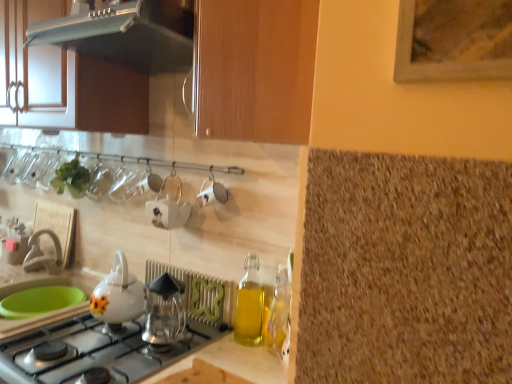
Question: In the image, is translucent glass bottle at right positioned in front of or behind white glossy teapot at lower left, the second kitchen appliance viewed from the top?

Choices:
 (A) behind
 (B) front

Answer: (B)

Question: From the image's perspective, relative to white glossy teapot at lower left, which is the 2th kitchen appliance in bottom-to-top order, is translucent glass bottle at right above or below?

Choices:
 (A) above
 (B) below

Answer: (B)

Question: Based on their relative distances, which object is nearer to the matte white faucet at lower left?

Choices:
 (A) white ceramic cup at center, the 2th tableware viewed from the left
 (B) clear glass vase at upper left, the second tableware in the front-to-back sequence
 (C) translucent glass bottle at right
 (D) matte wood cabinet at upper left
 (E) satin silver range hood at upper left, the third kitchen appliance in the bottom-to-top sequence

Answer: (B)

Question: Which object is positioned farthest from the white ceramic teapot at center?

Choices:
 (A) white glossy teapot at lower left, which is the 2th kitchen appliance in bottom-to-top order
 (B) translucent glass bottle at right
 (C) white ceramic cup at center, which is the first tableware from right to left
 (D) transparent glass coffee maker at center, the first kitchen appliance when ordered from bottom to top
 (E) matte wood cabinet at upper left

Answer: (B)